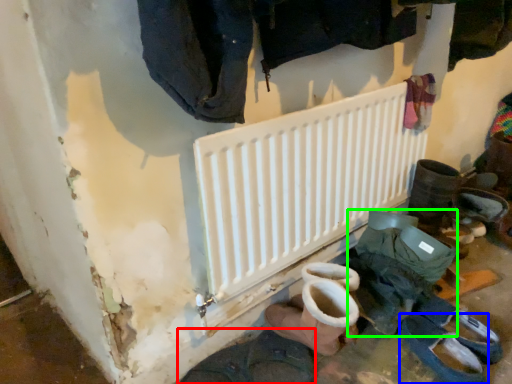
Question: Estimate the real-world distances between objects in this image. Which object is farther from footwear (highlighted by a red box), footwear (highlighted by a blue box) or footwear (highlighted by a green box)?

Choices:
 (A) footwear
 (B) footwear

Answer: (A)